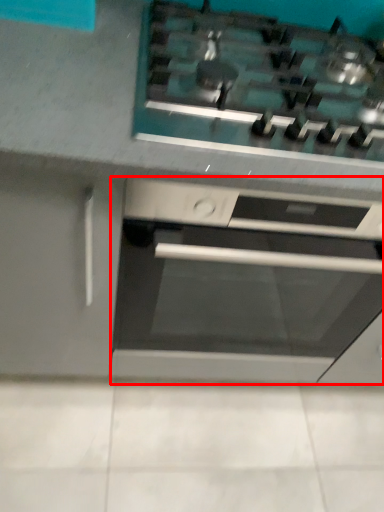
Question: From the image's perspective, considering the relative positions of home appliance (annotated by the red box) and gas stove in the image provided, where is home appliance (annotated by the red box) located with respect to the staircase?

Choices:
 (A) below
 (B) above

Answer: (A)